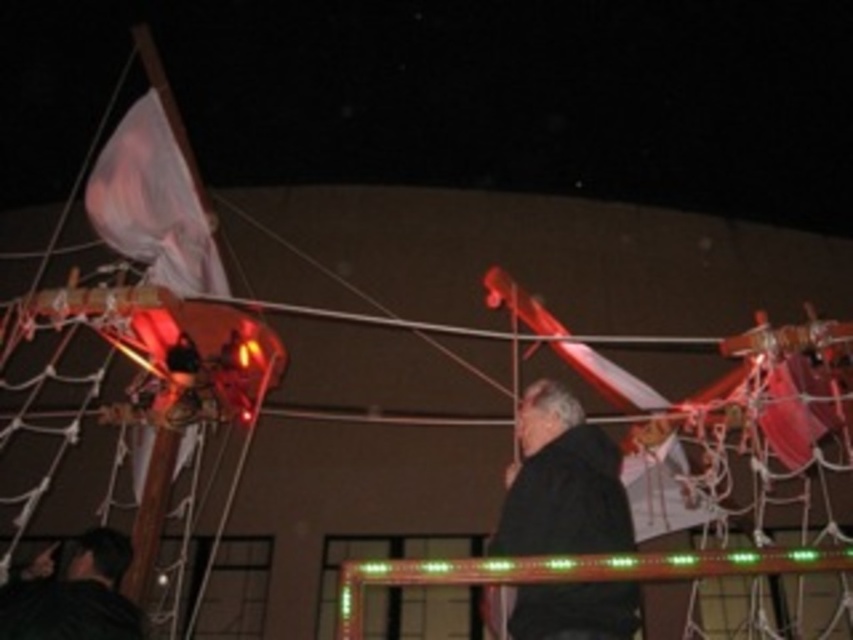
Question: Is black matte jacket at center smaller than black matte jacket at lower left?

Choices:
 (A) yes
 (B) no

Answer: (B)

Question: Is black matte jacket at center below black matte jacket at lower left?

Choices:
 (A) yes
 (B) no

Answer: (B)

Question: Which object appears closest to the camera in this image?

Choices:
 (A) black matte jacket at center
 (B) black matte jacket at lower left

Answer: (A)

Question: Which object is closer to the camera taking this photo?

Choices:
 (A) black matte jacket at lower left
 (B) black matte jacket at center

Answer: (B)

Question: Does black matte jacket at center have a greater width compared to black matte jacket at lower left?

Choices:
 (A) yes
 (B) no

Answer: (B)